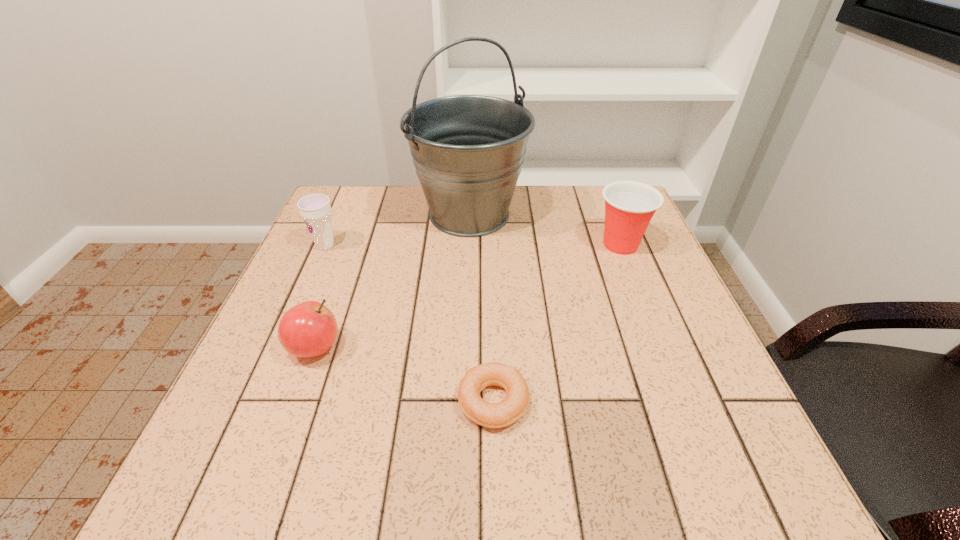
Find the location of a particular element. This screenshot has width=960, height=540. vacant area that lies between the fourth farthest object and the tallest object is located at coordinates (393, 281).

Find the location of a particular element. This screenshot has width=960, height=540. vacant space that's between the right cup and the fourth farthest object is located at coordinates (468, 296).

Locate an element on the screen. The image size is (960, 540). free spot between the left cup and the rightmost object is located at coordinates (473, 245).

At what (x,y) coordinates should I click in order to perform the action: click on vacant space that's between the bagel and the fourth tallest object. Please return your answer as a coordinate pair (x, y). This screenshot has width=960, height=540. Looking at the image, I should click on (404, 375).

Image resolution: width=960 pixels, height=540 pixels. Find the location of `vacant space in between the right cup and the left cup`. vacant space in between the right cup and the left cup is located at coordinates (473, 245).

At what (x,y) coordinates should I click in order to perform the action: click on free spot between the right cup and the tallest object. Please return your answer as a coordinate pair (x, y). Looking at the image, I should click on (545, 230).

Select which object appears as the closest to the left cup. Please provide its 2D coordinates. Your answer should be formatted as a tuple, i.e. [(x, y)], where the tuple contains the x and y coordinates of a point satisfying the conditions above.

[(468, 150)]

Locate which object is the fourth closest to the shortest object. Please provide its 2D coordinates. Your answer should be formatted as a tuple, i.e. [(x, y)], where the tuple contains the x and y coordinates of a point satisfying the conditions above.

[(315, 209)]

What are the coordinates of `vacant point that satisfies the following two spatial constraints: 1. on the back side of the rightmost object; 2. on the left side of the left cup` in the screenshot? It's located at (325, 245).

This screenshot has width=960, height=540. In order to click on free space that satisfies the following two spatial constraints: 1. on the front side of the shortest object; 2. on the right side of the left cup in this screenshot , I will do `click(257, 402)`.